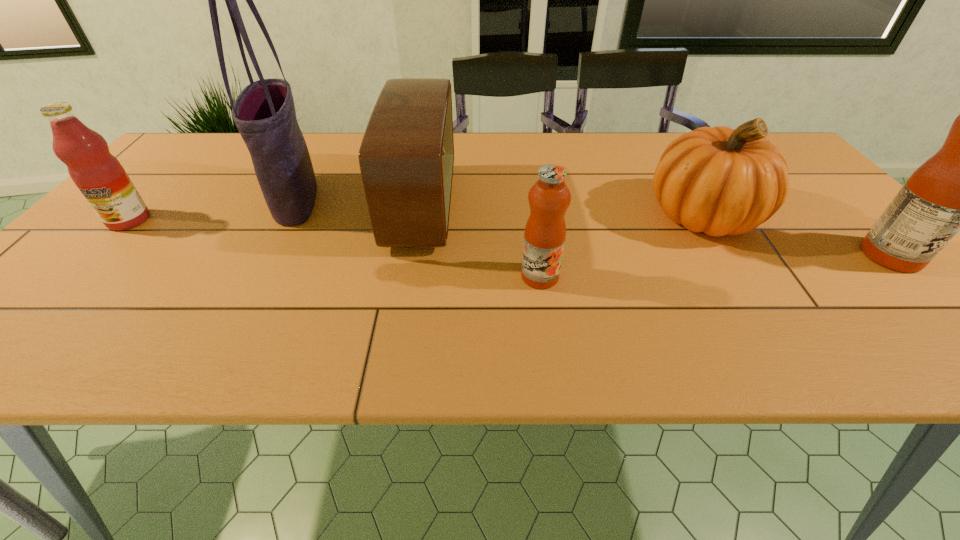
This screenshot has width=960, height=540. Identify the location of the fourth object from left to right. (549, 197).

This screenshot has width=960, height=540. What are the coordinates of `the fifth shortest object` in the screenshot? It's located at (959, 188).

Where is `the rightmost object`? The height and width of the screenshot is (540, 960). the rightmost object is located at coordinates 959,188.

Identify the location of pumpkin. This screenshot has width=960, height=540. (721, 181).

This screenshot has height=540, width=960. Identify the location of tote bag. (264, 112).

Identify the location of the fifth object from right to left. The image size is (960, 540). (264, 112).

Image resolution: width=960 pixels, height=540 pixels. I want to click on the third object from left to right, so click(406, 157).

Identify the location of the leftmost object. This screenshot has height=540, width=960. (100, 177).

The width and height of the screenshot is (960, 540). I want to click on the leftmost fruit juice, so click(x=100, y=177).

This screenshot has width=960, height=540. Find the location of `free space located on the right of the pumpkin`. free space located on the right of the pumpkin is located at coordinates (784, 215).